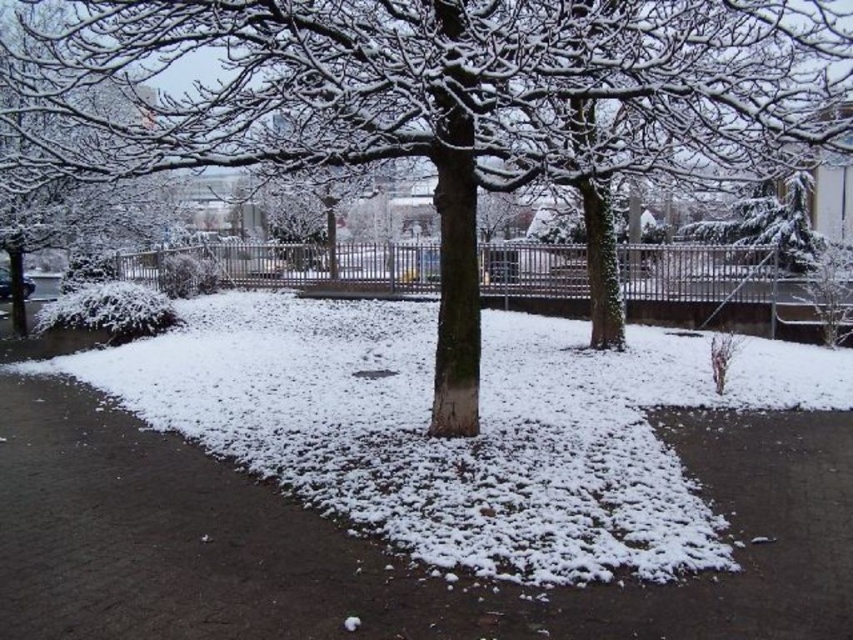
Is brown asphalt pavement at center positioned at the back of snow-covered tree at center?

No, it is not.

Can you confirm if brown asphalt pavement at center is positioned to the left of snow-covered tree at center?

Incorrect, brown asphalt pavement at center is not on the left side of snow-covered tree at center.

Who is more distant from viewer, (54, 481) or (96, 124)?

Positioned behind is point (96, 124).

Find the location of `brown asphalt pavement at center`. brown asphalt pavement at center is located at coordinates (421, 484).